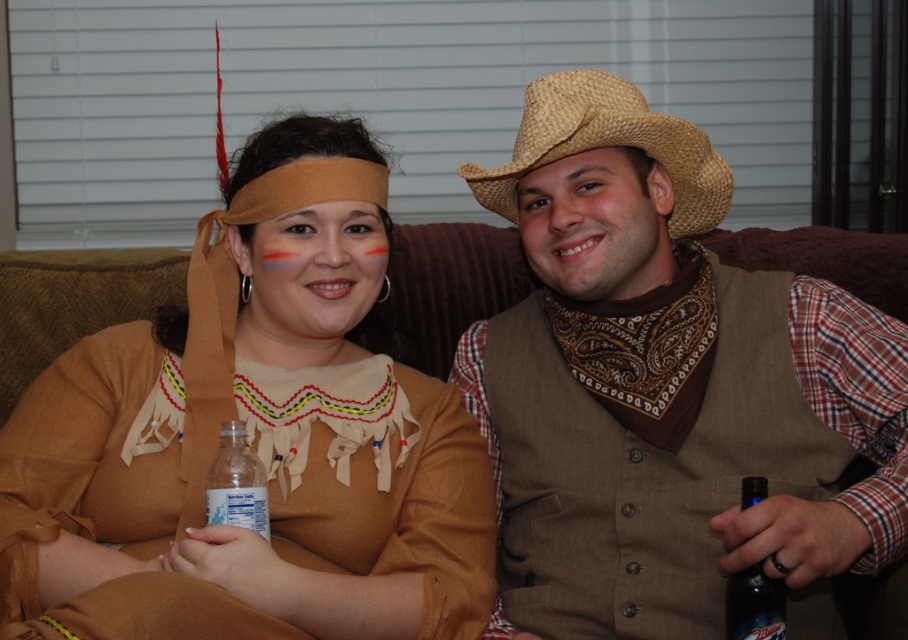
You are at a themed party and need to place both the straw hat at right and the blue glass beer bottle at lower right on a shelf. The shelf has a width limit of 15 cm. Can both items fit side by side?

The straw hat at right is wider than the blue glass beer bottle at lower right. However, since the shelf has a 15 cm width limit, we need to know the exact dimensions. Unfortunately, the description only states the comparative width between the two items, not their specific measurements. Therefore, it is impossible to determine if both will fit without additional information.